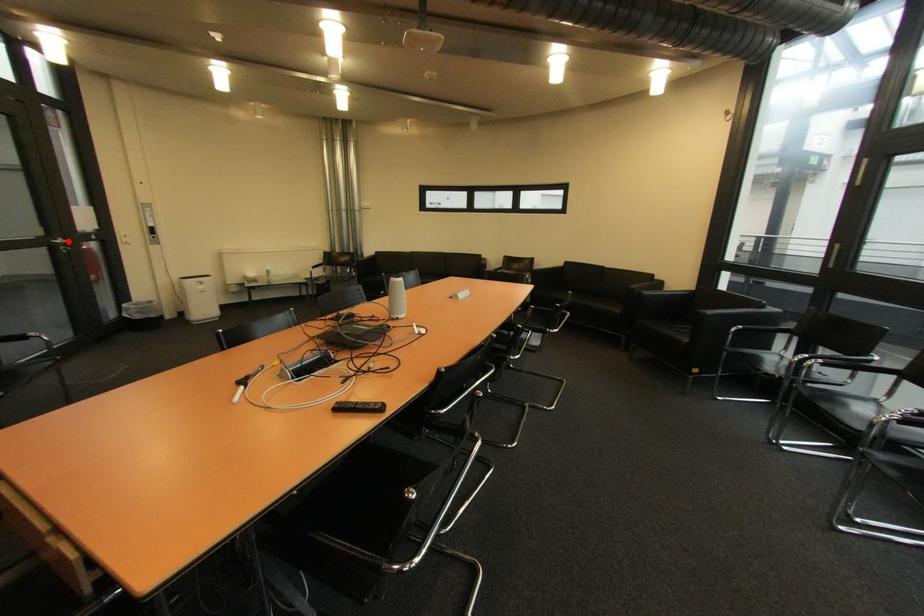
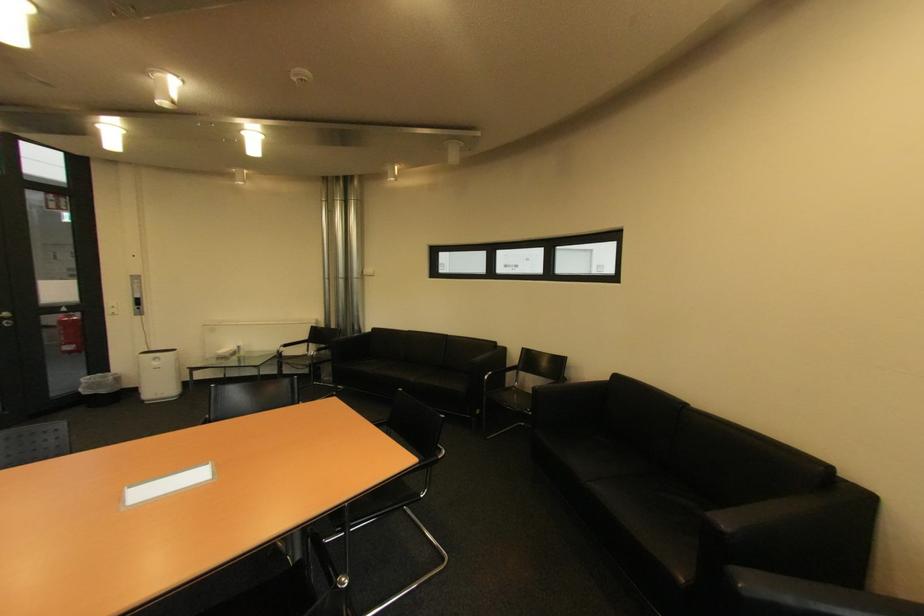
Find the pixel in the second image that matches the highlighted location in the first image.

(14, 315)